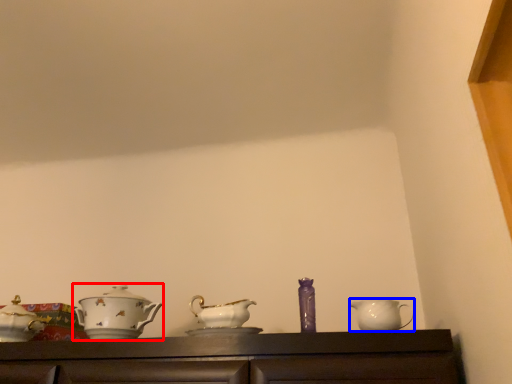
Question: Which point is closer to the camera, tableware (highlighted by a red box) or jug (highlighted by a blue box)?

Choices:
 (A) tableware
 (B) jug

Answer: (B)